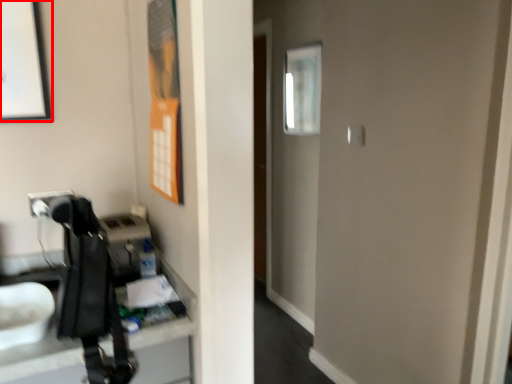
Question: From the image's perspective, what is the correct spatial relationship of picture frame (annotated by the red box) in relation to mirror?

Choices:
 (A) above
 (B) below

Answer: (B)